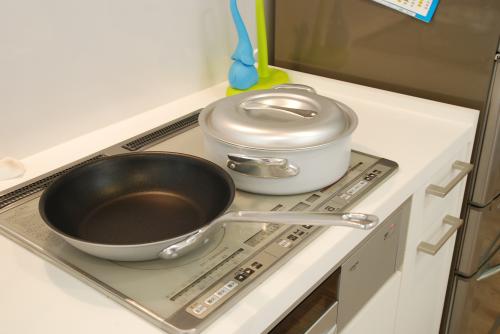
The width and height of the screenshot is (500, 334). What are the coordinates of `white sauce pan on stove top` in the screenshot? It's located at (316, 177).